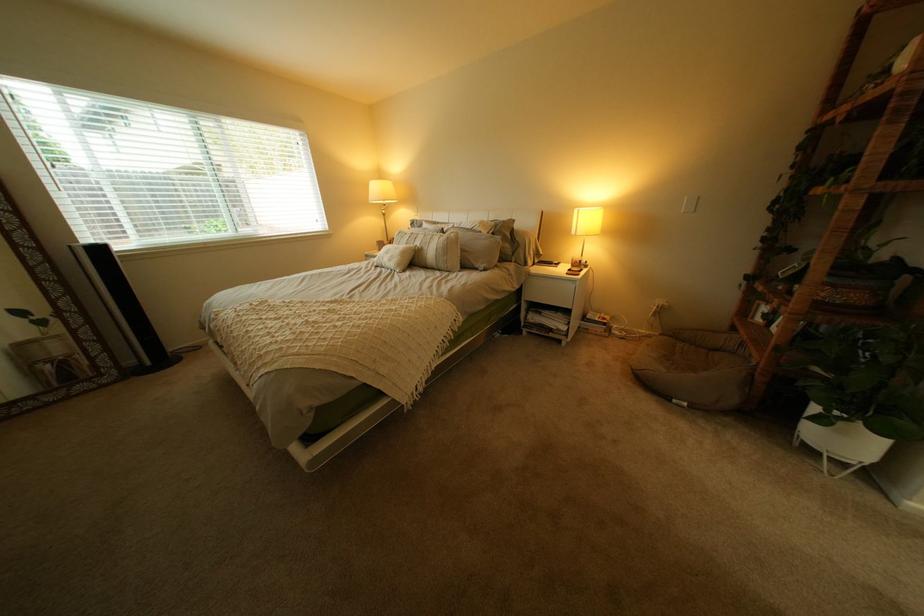
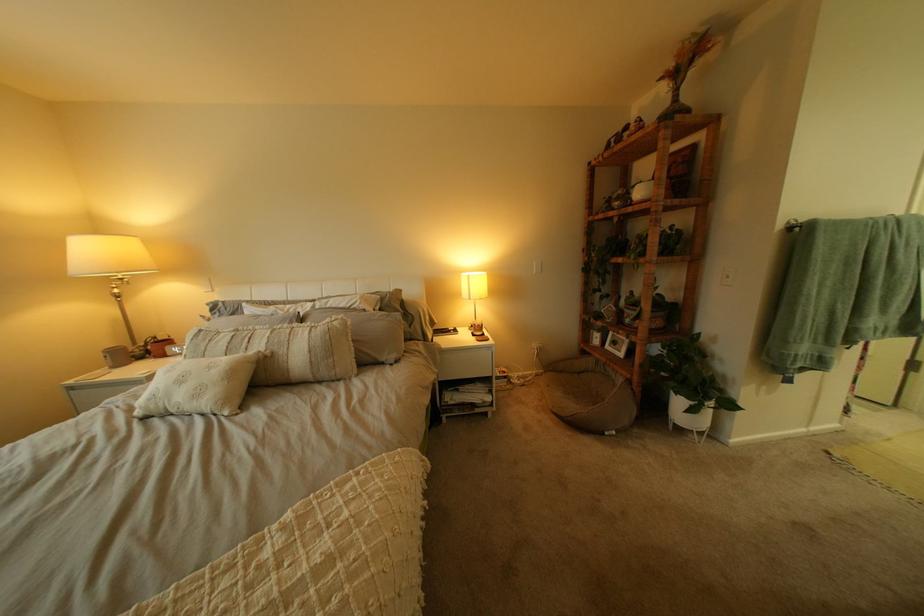
The point at (791, 329) is marked in the first image. Where is the corresponding point in the second image?

(623, 347)